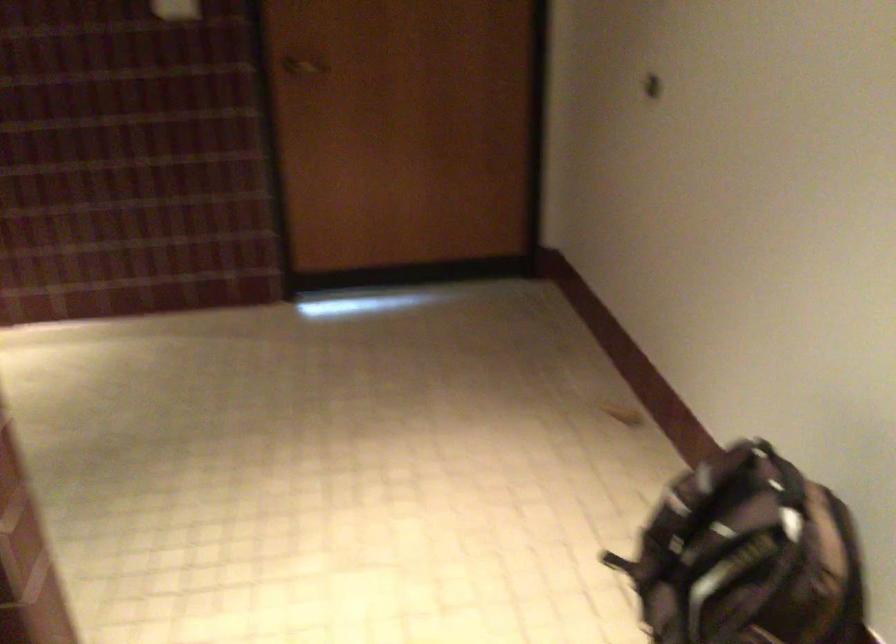
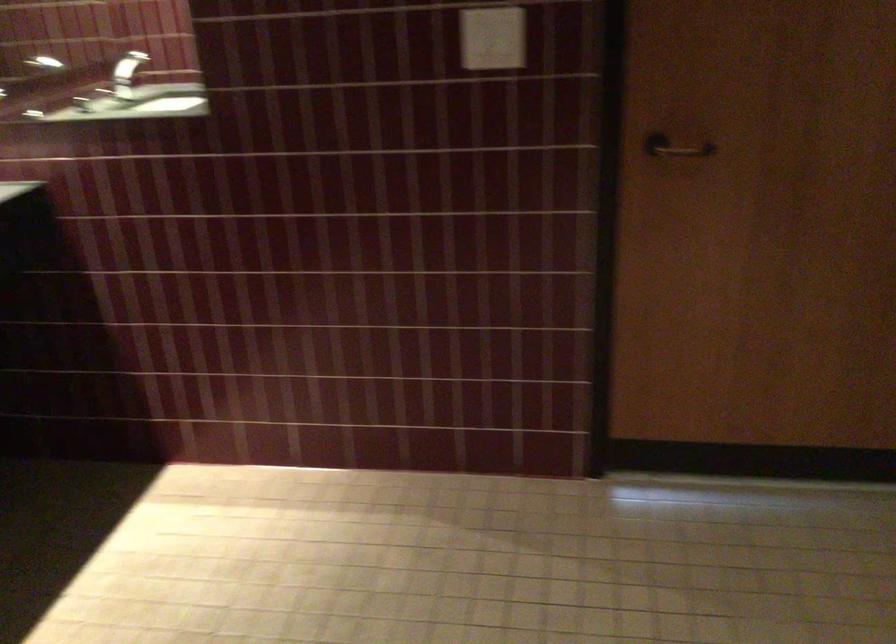
Find the pixel in the second image that matches pixel 431 178 in the first image.

(857, 321)